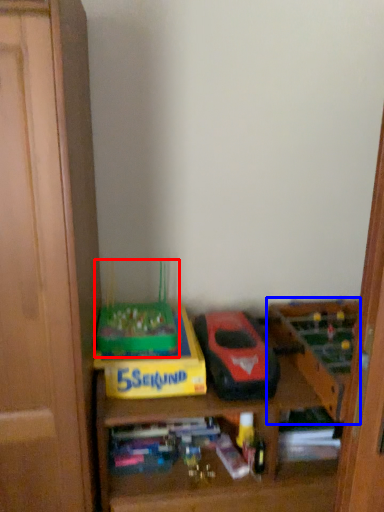
Question: Which object is further to the camera taking this photo, toy (highlighted by a red box) or toy (highlighted by a blue box)?

Choices:
 (A) toy
 (B) toy

Answer: (A)